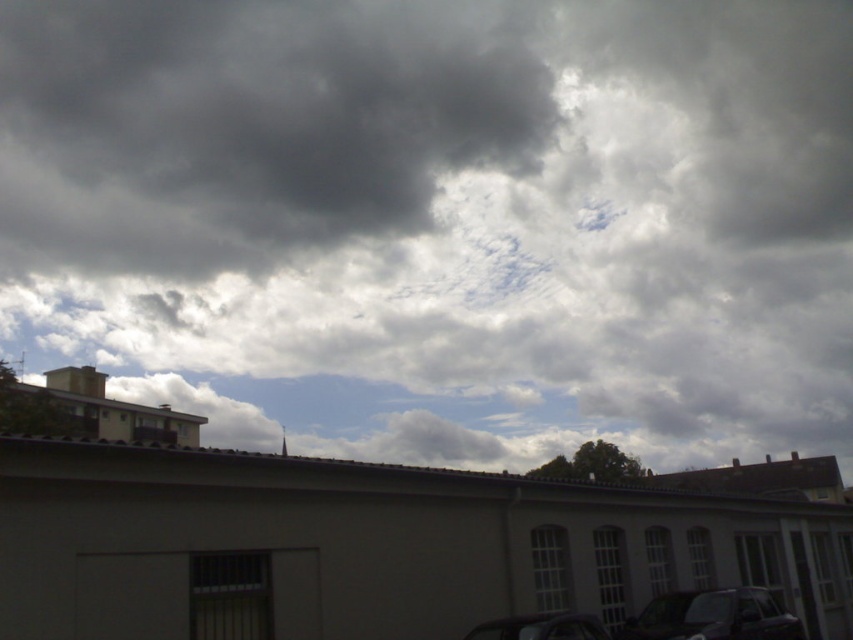
Does dark gray cloud at upper left appear on the right side of shiny black car at bottom right?

In fact, dark gray cloud at upper left is to the left of shiny black car at bottom right.

Who is more forward, (167, 205) or (709, 618)?

Positioned in front is point (709, 618).

You are a GUI agent. You are given a task and a screenshot of the screen. Output one action in this format:
    pyautogui.click(x=<x>, y=<y>)
    Task: Click on the dark gray cloud at upper left
    
    Given the screenshot: What is the action you would take?
    pyautogui.click(x=248, y=125)

Between dark gray cloud at upper center and shiny black car at bottom right, which one appears on the right side from the viewer's perspective?

shiny black car at bottom right is more to the right.

Between point (718, 374) and point (798, 630), which one is positioned behind?

Point (718, 374)

Is point (216, 49) closer to camera compared to point (666, 621)?

No, (216, 49) is further to viewer.

Identify the location of dark gray cloud at upper center. This screenshot has width=853, height=640. (440, 221).

Who is positioned more to the right, dark gray cloud at upper left or shiny black car at lower center?

shiny black car at lower center is more to the right.

Between point (25, 192) and point (583, 628), which one is positioned in front?

Positioned in front is point (583, 628).

Is point (427, 204) positioned behind point (577, 618)?

Yes, it is.

Locate an element on the screen. The image size is (853, 640). dark gray cloud at upper left is located at coordinates (248, 125).